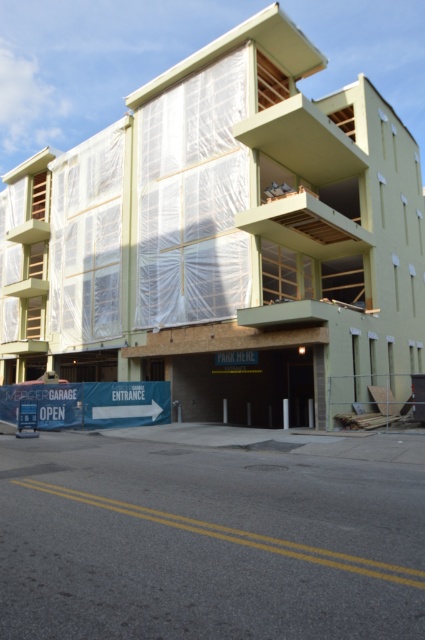
You are standing on the sidewalk in front of the Mercer Garage. You see two points marked on the building facade. The first point is at coordinates point (328, 376) and the second at point (297, 502). Which point is closer to you?

Point (297, 502) is closer to you because it is less further to the camera than point (328, 376).

You are standing in front of the Mercer Garage entrance and want to reach a specific point marked at coordinates point (x=129, y=195). The garage has a height restriction of 8 feet. Can you safely enter the garage with your vehicle that is 7.5 feet tall?

The distance of point (x=129, y=195) from camera is 87.11 feet. Since the garage has a height restriction of 8 feet and your vehicle is 7.5 feet tall, which is under the limit, you can safely enter the garage with your vehicle that is 7.5 feet tall.

You are a pedestrian standing on the concrete pavement at lower center. Looking up, can you see the green plastic building at center from your current position?

Yes, the green plastic building at center is above the concrete pavement at lower center, so when standing on the concrete pavement at lower center, you can look up and see the green plastic building at center.